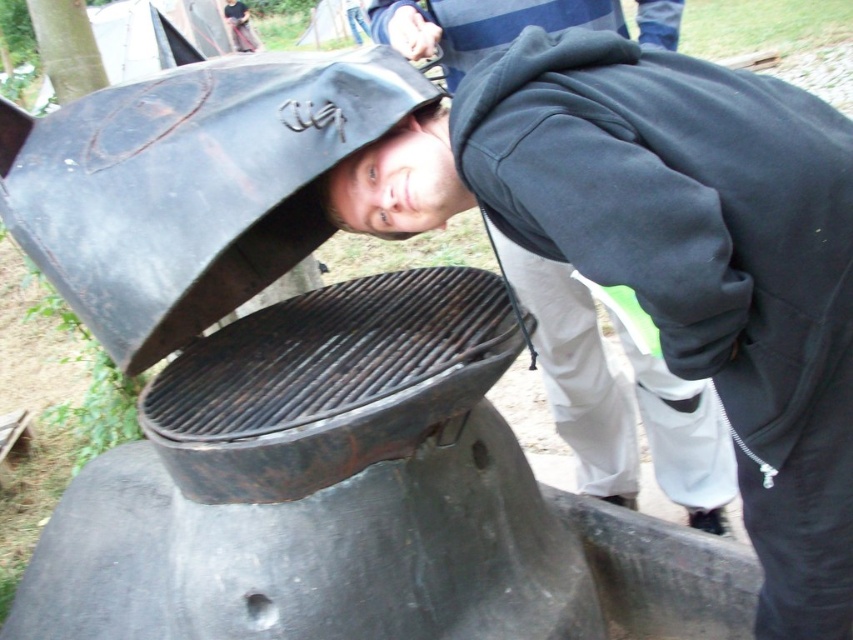
Who is lower down, dark blue fleece at center or rusty metal grill at center?

rusty metal grill at center

Describe the element at coordinates (679, 208) in the screenshot. The height and width of the screenshot is (640, 853). I see `dark blue fleece at center` at that location.

Which is behind, point (776, 132) or point (293, 355)?

The point (293, 355) is behind.

Locate an element on the screen. The height and width of the screenshot is (640, 853). dark blue fleece at center is located at coordinates (679, 208).